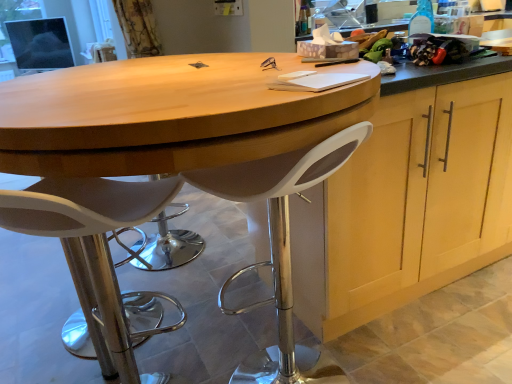
The image size is (512, 384). Identify the location of unoccupied space behind white plastic stool at center, which is the first chair from right to left. (251, 325).